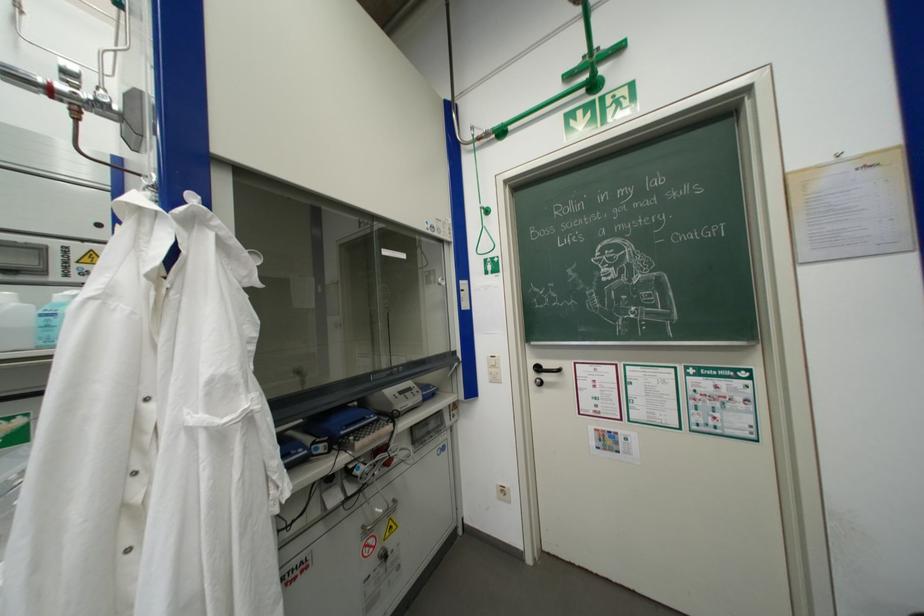
What do you see at coordinates (503, 493) in the screenshot? I see `the white light switch` at bounding box center [503, 493].